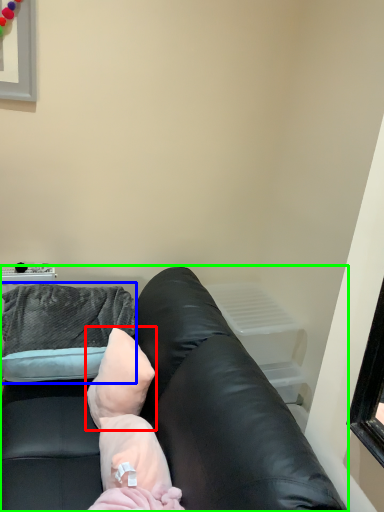
Question: Based on their relative distances, which object is nearer to pillow (highlighted by a red box)? Choose from throw pillow (highlighted by a blue box) and studio couch (highlighted by a green box).

Choices:
 (A) throw pillow
 (B) studio couch

Answer: (B)